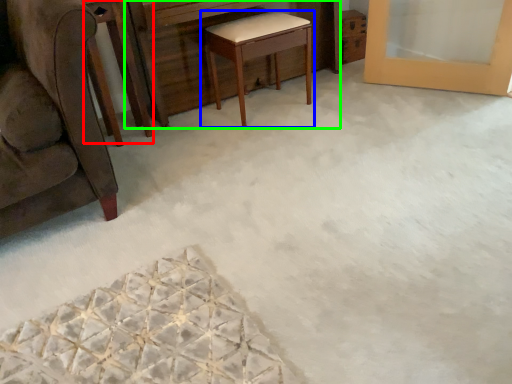
Question: Which object is the farthest from round table (highlighted by a red box)? Choose among these: table (highlighted by a blue box) or vanity (highlighted by a green box).

Choices:
 (A) table
 (B) vanity

Answer: (A)